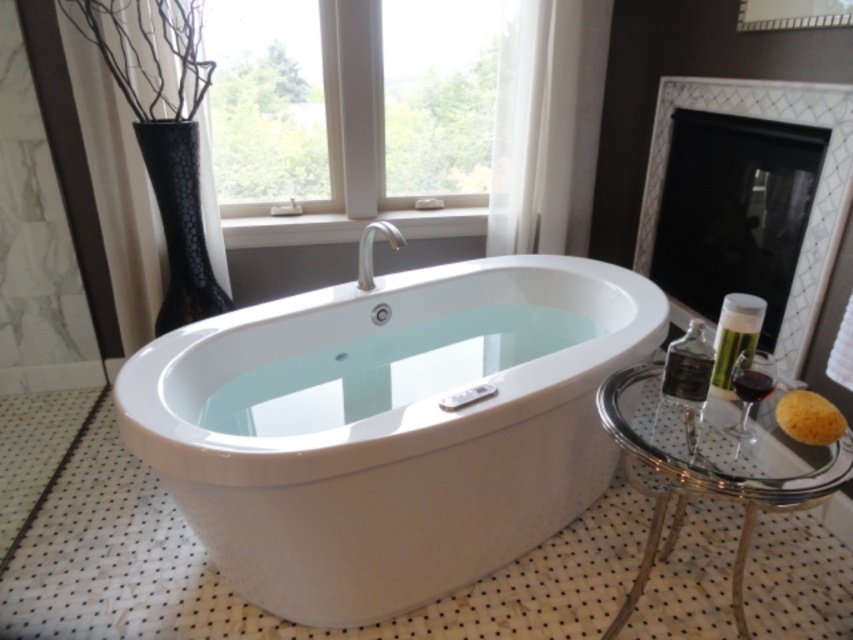
Question: Is transparent glass window at upper center to the left of white textured fireplace at right from the viewer's perspective?

Choices:
 (A) no
 (B) yes

Answer: (B)

Question: Which object is positioned closest to the white glossy bathtub at center?

Choices:
 (A) clear glass stool at lower right
 (B) transparent glass window at upper center
 (C) white textured fireplace at right

Answer: (A)

Question: Is clear glass stool at lower right closer to camera compared to white textured fireplace at right?

Choices:
 (A) no
 (B) yes

Answer: (B)

Question: Is white glossy bathtub at center above transparent glass window at upper center?

Choices:
 (A) no
 (B) yes

Answer: (A)

Question: Estimate the real-world distances between objects in this image. Which object is farther from the clear glass stool at lower right?

Choices:
 (A) white glossy bathtub at center
 (B) white textured fireplace at right

Answer: (B)

Question: Which of the following is the closest to the observer?

Choices:
 (A) transparent glass window at upper center
 (B) white glossy bathtub at center
 (C) clear glass stool at lower right
 (D) white textured fireplace at right

Answer: (C)